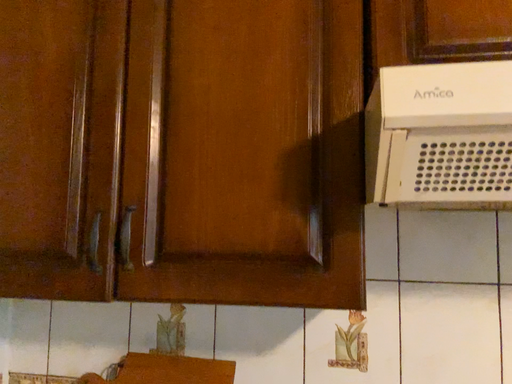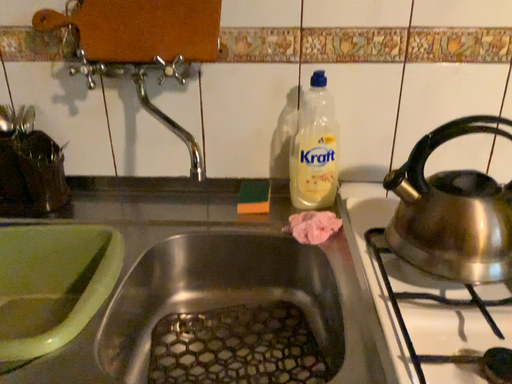
Question: How did the camera likely rotate when shooting the video?

Choices:
 (A) rotated downward
 (B) rotated upward

Answer: (A)